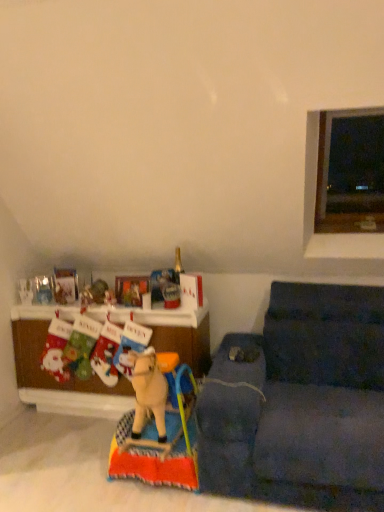
Describe the element at coordinates (131, 289) in the screenshot. I see `metallic reflective picture frame at center` at that location.

Identify the location of matte plastic toy at left, positioned as the 1th toy in top-to-bottom order. (43, 290).

At what (x,y) coordinates should I click in order to perform the action: click on wooden horse at center, positioned as the first toy in bottom-to-top order. Please return your answer as a coordinate pair (x, y). This screenshot has width=384, height=512. Looking at the image, I should click on (158, 425).

Is wooden horse at center, which is the 2th toy in left-to-right order, looking in the opposite direction of metallic reflective picture frame at center?

No.

How distant is wooden horse at center, positioned as the first toy in front-to-back order, from metallic reflective picture frame at center?

wooden horse at center, positioned as the first toy in front-to-back order, is 30.02 inches from metallic reflective picture frame at center.

The width and height of the screenshot is (384, 512). In order to click on picture frame behind the wooden horse at center, the first toy in the right-to-left sequence in this screenshot , I will do `click(131, 289)`.

Is the surface of wooden horse at center, positioned as the first toy in front-to-back order, in direct contact with metallic reflective picture frame at center?

wooden horse at center, positioned as the first toy in front-to-back order, and metallic reflective picture frame at center are clearly separated.

Is point (360, 446) in front of point (198, 319)?

Yes, point (360, 446) is closer to viewer.

Between dark blue fabric couch at lower right and wooden cabinet at lower left, which one has larger size?

dark blue fabric couch at lower right.

From a real-world perspective, which object rests below the other?

dark blue fabric couch at lower right.

Considering the sizes of transparent glass window at upper right and metallic reflective picture frame at center in the image, is transparent glass window at upper right wider or thinner than metallic reflective picture frame at center?

Clearly, transparent glass window at upper right has more width compared to metallic reflective picture frame at center.

In the scene shown: Is transparent glass window at upper right beside metallic reflective picture frame at center?

No, transparent glass window at upper right is not with metallic reflective picture frame at center.

Looking at the image, does transparent glass window at upper right seem bigger or smaller compared to metallic reflective picture frame at center?

transparent glass window at upper right is bigger than metallic reflective picture frame at center.

From the image's perspective, who appears lower, transparent glass window at upper right or matte plastic toy at left, which appears as the second toy when viewed from the right?

matte plastic toy at left, which appears as the second toy when viewed from the right, appears lower in the image.

Is matte plastic toy at left, the 1th toy positioned from the left, at the back of transparent glass window at upper right?

No, transparent glass window at upper right is not facing the opposite direction of matte plastic toy at left, the 1th toy positioned from the left.

Can you confirm if transparent glass window at upper right is smaller than matte plastic toy at left, the second toy viewed from the front?

Actually, transparent glass window at upper right might be larger than matte plastic toy at left, the second toy viewed from the front.

Image resolution: width=384 pixels, height=512 pixels. In order to click on window above the matte plastic toy at left, the second toy when ordered from bottom to top (from the image's perspective) in this screenshot , I will do `click(350, 172)`.

How different are the orientations of metallic reflective picture frame at center and wooden horse at center, which is counted as the second toy, starting from the back, in degrees?

The angular difference between metallic reflective picture frame at center and wooden horse at center, which is counted as the second toy, starting from the back, is 11.2 degrees.

Is metallic reflective picture frame at center aimed at wooden horse at center, which is the second toy from top to bottom?

No.

Find the location of `toy on the right of metallic reflective picture frame at center`. toy on the right of metallic reflective picture frame at center is located at coordinates (158, 425).

From a real-world perspective, does metallic reflective picture frame at center sit lower than wooden horse at center, the first toy in the right-to-left sequence?

No, from a real-world perspective, metallic reflective picture frame at center is not under wooden horse at center, the first toy in the right-to-left sequence.

Identify the location of the 2nd toy above the dark blue fabric couch at lower right (from a real-world perspective). The image size is (384, 512). (43, 290).

Does dark blue fabric couch at lower right have a greater height compared to matte plastic toy at left, the 1th toy positioned from the left?

Yes.

Is dark blue fabric couch at lower right in contact with matte plastic toy at left, which appears as the second toy when viewed from the right?

dark blue fabric couch at lower right and matte plastic toy at left, which appears as the second toy when viewed from the right, are not in contact.

Could you tell me if dark blue fabric couch at lower right is facing matte plastic toy at left, positioned as the 1th toy in top-to-bottom order?

No, dark blue fabric couch at lower right is not facing towards matte plastic toy at left, positioned as the 1th toy in top-to-bottom order.

From the image's perspective, is dark blue fabric couch at lower right on transparent glass window at upper right?

No, from the image's perspective, dark blue fabric couch at lower right is not over transparent glass window at upper right.

Which of these two, dark blue fabric couch at lower right or transparent glass window at upper right, is bigger?

dark blue fabric couch at lower right.

Can you confirm if dark blue fabric couch at lower right is taller than transparent glass window at upper right?

No, dark blue fabric couch at lower right is not taller than transparent glass window at upper right.

Is dark blue fabric couch at lower right spatially inside transparent glass window at upper right, or outside of it?

dark blue fabric couch at lower right cannot be found inside transparent glass window at upper right.

Where is `picture frame above the wooden horse at center, positioned as the first toy in bottom-to-top order (from the image's perspective)`? The image size is (384, 512). picture frame above the wooden horse at center, positioned as the first toy in bottom-to-top order (from the image's perspective) is located at coordinates (131, 289).

Identify the location of studio couch that appears in front of the wooden cabinet at lower left. The image size is (384, 512). (301, 403).

From the image, which object appears to be nearer to dark blue fabric couch at lower right, matte plastic toy at left, positioned as the 1th toy in top-to-bottom order, or metallic reflective picture frame at center?

The object closer to dark blue fabric couch at lower right is metallic reflective picture frame at center.

Looking at the image, which one is located further to matte plastic toy at left, which appears as the second toy when viewed from the right, transparent glass window at upper right or wooden cabinet at lower left?

Based on the image, transparent glass window at upper right appears to be further to matte plastic toy at left, which appears as the second toy when viewed from the right.

Estimate the real-world distances between objects in this image. Which object is closer to matte plastic toy at left, the 1th toy viewed from the back, metallic reflective picture frame at center or dark blue fabric couch at lower right?

The object closer to matte plastic toy at left, the 1th toy viewed from the back, is metallic reflective picture frame at center.

When comparing their distances from metallic reflective picture frame at center, does wooden horse at center, which is the 2th toy in left-to-right order, or wooden cabinet at lower left seem further?

wooden horse at center, which is the 2th toy in left-to-right order.

From the image, which object appears to be farther from wooden cabinet at lower left, matte plastic toy at left, positioned as the 1th toy in top-to-bottom order, or dark blue fabric couch at lower right?

Among the two, dark blue fabric couch at lower right is located further to wooden cabinet at lower left.

When comparing their distances from transparent glass window at upper right, does wooden horse at center, which is counted as the second toy, starting from the back, or metallic reflective picture frame at center seem closer?

metallic reflective picture frame at center.

When comparing their distances from dark blue fabric couch at lower right, does metallic reflective picture frame at center or transparent glass window at upper right seem closer?

Based on the image, transparent glass window at upper right appears to be nearer to dark blue fabric couch at lower right.

Estimate the real-world distances between objects in this image. Which object is further from matte plastic toy at left, the second toy viewed from the front, wooden cabinet at lower left or transparent glass window at upper right?

The object further to matte plastic toy at left, the second toy viewed from the front, is transparent glass window at upper right.

The height and width of the screenshot is (512, 384). Find the location of `picture frame situated between matte plastic toy at left, positioned as the 1th toy in top-to-bottom order, and transparent glass window at upper right from left to right`. picture frame situated between matte plastic toy at left, positioned as the 1th toy in top-to-bottom order, and transparent glass window at upper right from left to right is located at coordinates (131, 289).

At what (x,y) coordinates should I click in order to perform the action: click on picture frame located between wooden cabinet at lower left and dark blue fabric couch at lower right in the left-right direction. Please return your answer as a coordinate pair (x, y). Looking at the image, I should click on (131, 289).

Find the location of `toy situated between matte plastic toy at left, the second toy viewed from the front, and transparent glass window at upper right from left to right`. toy situated between matte plastic toy at left, the second toy viewed from the front, and transparent glass window at upper right from left to right is located at coordinates (158, 425).

You are a GUI agent. You are given a task and a screenshot of the screen. Output one action in this format:
    pyautogui.click(x=<x>, y=<y>)
    Task: Click on the studio couch located between metallic reflective picture frame at center and transparent glass window at upper right in the left-right direction
    The width and height of the screenshot is (384, 512).
    Given the screenshot: What is the action you would take?
    pyautogui.click(x=301, y=403)